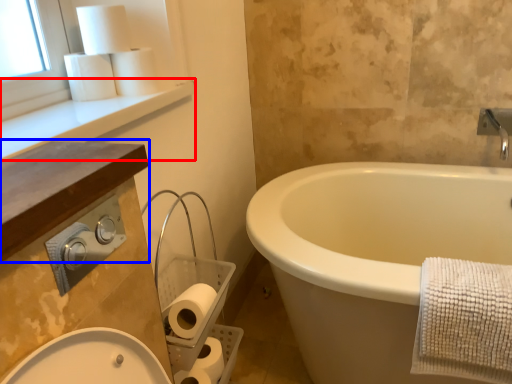
Question: Among these objects, which one is farthest to the camera, window sill (highlighted by a red box) or counter top (highlighted by a blue box)?

Choices:
 (A) window sill
 (B) counter top

Answer: (A)